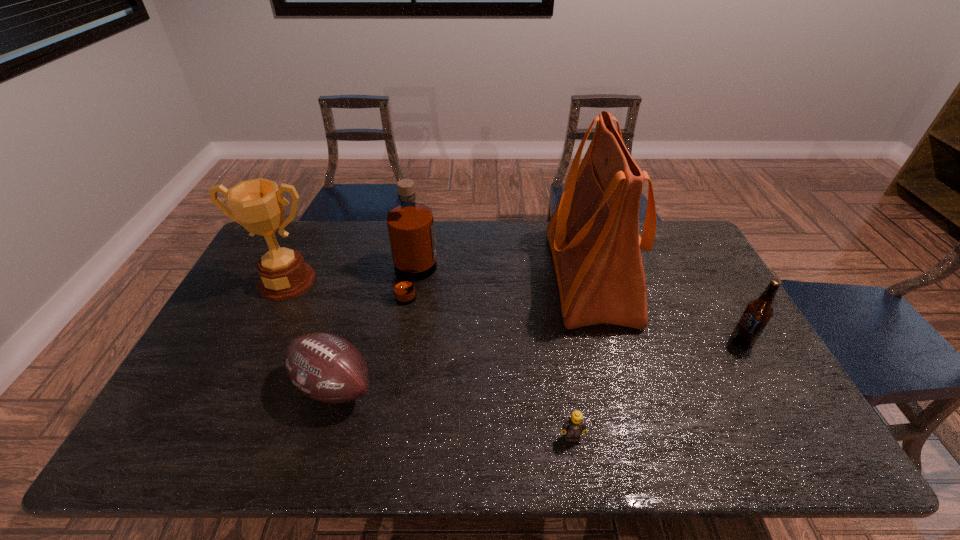
Locate an element on the screen. The image size is (960, 540). vacant space located on the front pocket of the shopping bag is located at coordinates (456, 275).

You are a GUI agent. You are given a task and a screenshot of the screen. Output one action in this format:
    pyautogui.click(x=<x>, y=<y>)
    Task: Click on the vacant region located 0.330m on the front pocket of the shopping bag
    The width and height of the screenshot is (960, 540).
    Given the screenshot: What is the action you would take?
    pyautogui.click(x=447, y=275)

Where is `blank space located on the front-facing side of the award`? The height and width of the screenshot is (540, 960). blank space located on the front-facing side of the award is located at coordinates (248, 361).

This screenshot has width=960, height=540. In order to click on free location located on the front label of the liquor in this screenshot , I will do click(482, 278).

The width and height of the screenshot is (960, 540). I want to click on vacant space located on the label of the rightmost object, so click(612, 342).

Where is `free point located 0.350m on the label of the rightmost object`? The image size is (960, 540). free point located 0.350m on the label of the rightmost object is located at coordinates (606, 342).

Where is `free spot located on the label of the rightmost object`? Image resolution: width=960 pixels, height=540 pixels. free spot located on the label of the rightmost object is located at coordinates (708, 342).

Find the location of a particular element. vacant region located 0.280m on the left of the fifth tallest object is located at coordinates (180, 386).

What are the coordinates of `shopping bag situated at the far edge` in the screenshot? It's located at (593, 234).

Locate an element on the screen. This screenshot has width=960, height=540. liquor present at the far edge is located at coordinates (410, 225).